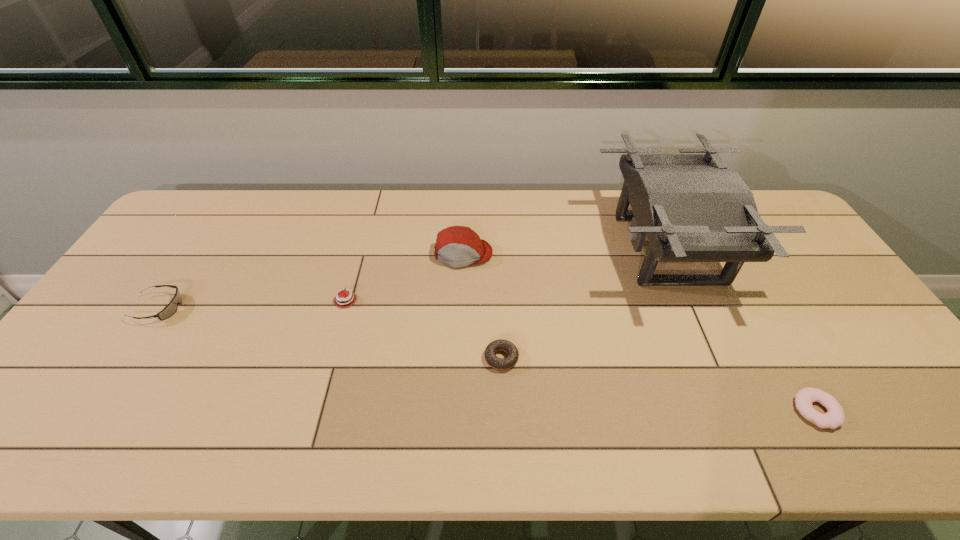
Where is `vacant area between the fifth farthest object and the fifth shortest object`? The image size is (960, 540). vacant area between the fifth farthest object and the fifth shortest object is located at coordinates (482, 306).

Where is `vacant space in between the drone and the leftmost object`? vacant space in between the drone and the leftmost object is located at coordinates (413, 279).

The height and width of the screenshot is (540, 960). I want to click on free space between the second nearest object and the goggles, so click(x=330, y=333).

The image size is (960, 540). Find the location of `object that is the fourth closest to the tallest object`. object that is the fourth closest to the tallest object is located at coordinates (351, 298).

Locate an element on the screen. The width and height of the screenshot is (960, 540). object that stands as the third closest to the drone is located at coordinates (456, 246).

You are a GUI agent. You are given a task and a screenshot of the screen. Output one action in this format:
    pyautogui.click(x=<x>, y=<y>)
    Task: Click on the vacant space that satisfies the following two spatial constraints: 1. on the back side of the nearest object; 2. with a camera mounted on the underside of the drone
    The image size is (960, 540).
    Given the screenshot: What is the action you would take?
    pyautogui.click(x=724, y=249)

Find the location of a particular element. The height and width of the screenshot is (540, 960). free location that satisfies the following two spatial constraints: 1. on the front-facing side of the second tallest object; 2. on the lenses of the goggles is located at coordinates (461, 308).

The height and width of the screenshot is (540, 960). In order to click on free space that satisfies the following two spatial constraints: 1. on the front-facing side of the second tallest object; 2. on the lenses of the third tallest object in this screenshot , I will do `click(461, 308)`.

Where is `blank area in the image that satisfies the following two spatial constraints: 1. on the front side of the second object from left to right; 2. on the right side of the nearest object`? This screenshot has width=960, height=540. blank area in the image that satisfies the following two spatial constraints: 1. on the front side of the second object from left to right; 2. on the right side of the nearest object is located at coordinates (315, 410).

Locate an element on the screen. The height and width of the screenshot is (540, 960). free location that satisfies the following two spatial constraints: 1. with a camera mounted on the underside of the drone; 2. on the right side of the shorter doughnut is located at coordinates (737, 410).